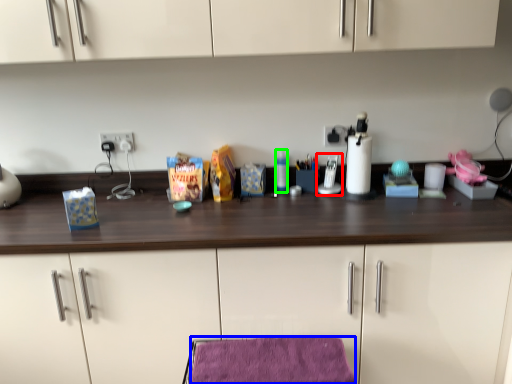
Question: Estimate the real-world distances between objects in this image. Which object is closer to appliance (highlighted by a red box), velvet (highlighted by a blue box) or bottle (highlighted by a green box)?

Choices:
 (A) velvet
 (B) bottle

Answer: (B)